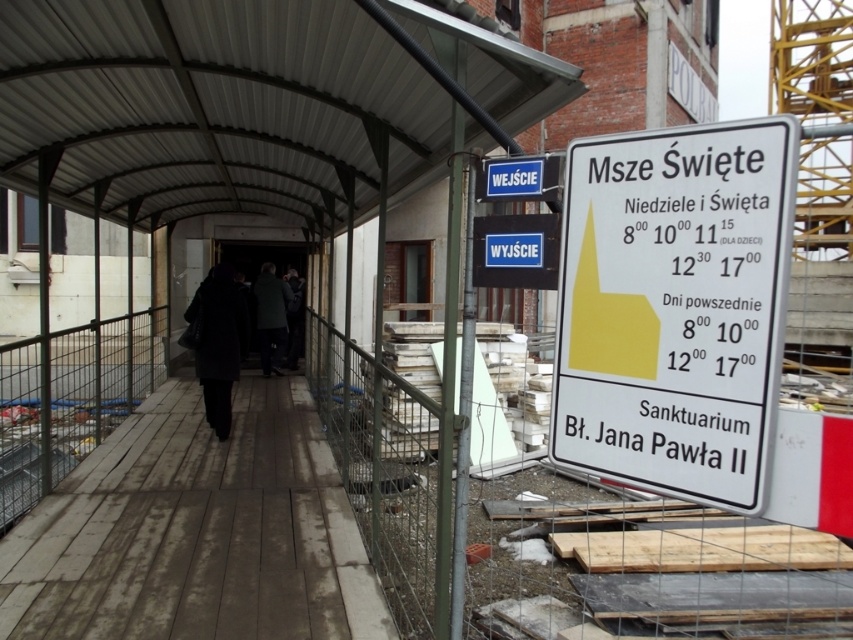
Question: Observing the image, what is the correct spatial positioning of white plastic sign at right in reference to dark green coat at center?

Choices:
 (A) right
 (B) left

Answer: (A)

Question: Is black wool coat at center bigger than dark green coat at center?

Choices:
 (A) no
 (B) yes

Answer: (A)

Question: Can you confirm if metallic corrugated roof at upper center is wider than white plastic sign at right?

Choices:
 (A) yes
 (B) no

Answer: (B)

Question: Which of the following is the closest to the observer?

Choices:
 (A) white plastic sign at right
 (B) metallic corrugated roof at upper center
 (C) dark green coat at center
 (D) black wool coat at center

Answer: (A)

Question: Which object appears closest to the camera in this image?

Choices:
 (A) wooden planks at center
 (B) white plastic sign at right
 (C) black wool coat at center
 (D) metallic corrugated roof at upper center

Answer: (B)

Question: Estimate the real-world distances between objects in this image. Which object is farther from the white plastic sign at right?

Choices:
 (A) black wool coat at center
 (B) wooden planks at center

Answer: (A)